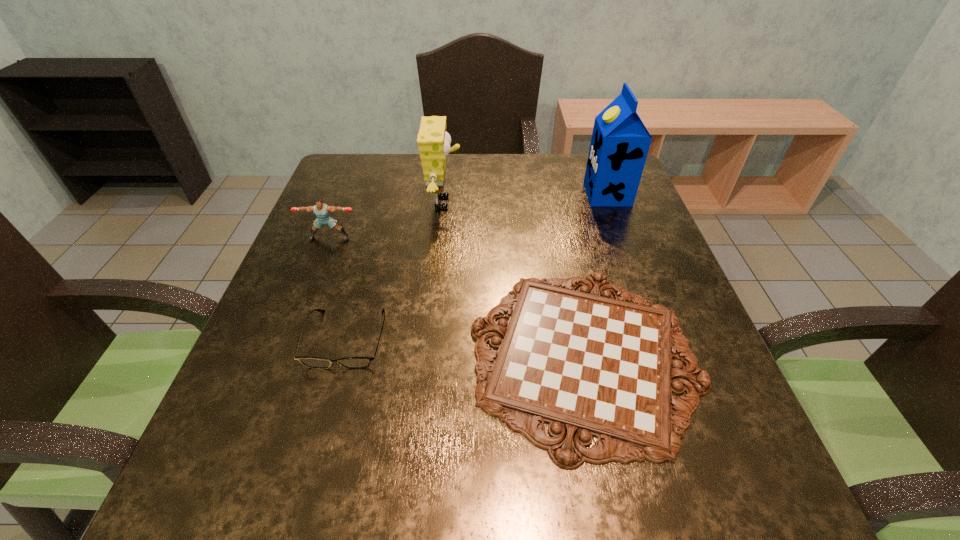
Locate an element on the screen. This screenshot has width=960, height=540. chessboard that is at the right edge is located at coordinates (588, 365).

I want to click on object located in the far right corner section of the desktop, so click(x=620, y=142).

Where is `object positioned at the near right corner`? The image size is (960, 540). object positioned at the near right corner is located at coordinates (588, 365).

In the image, there is a desktop. What are the coordinates of `vacant space at the far edge` in the screenshot? It's located at (475, 194).

In the image, there is a desktop. At what (x,y) coordinates should I click in order to perform the action: click on vacant space at the near edge. Please return your answer as a coordinate pair (x, y). Image resolution: width=960 pixels, height=540 pixels. Looking at the image, I should click on (491, 498).

Identify the location of vacant space at the left edge of the desktop. (243, 385).

Image resolution: width=960 pixels, height=540 pixels. In the image, there is a desktop. Identify the location of vacant space at the right edge. (614, 268).

Locate an element on the screen. free location at the far left corner is located at coordinates (358, 159).

Locate an element on the screen. The image size is (960, 540). free space at the near right corner of the desktop is located at coordinates (678, 463).

The image size is (960, 540). In order to click on free spot between the third tallest object and the shortest object in this screenshot , I will do `click(457, 296)`.